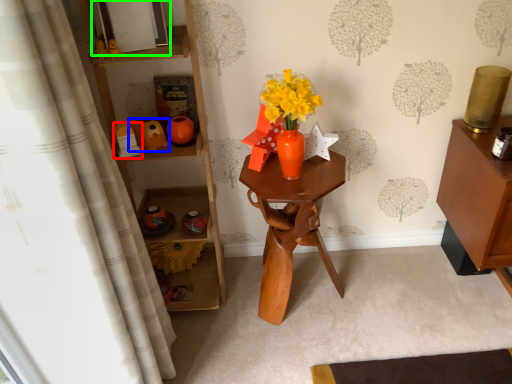
Question: Estimate the real-world distances between objects in this image. Which object is closer to toy (highlighted by a red box), toy (highlighted by a blue box) or picture frame (highlighted by a green box)?

Choices:
 (A) toy
 (B) picture frame

Answer: (A)